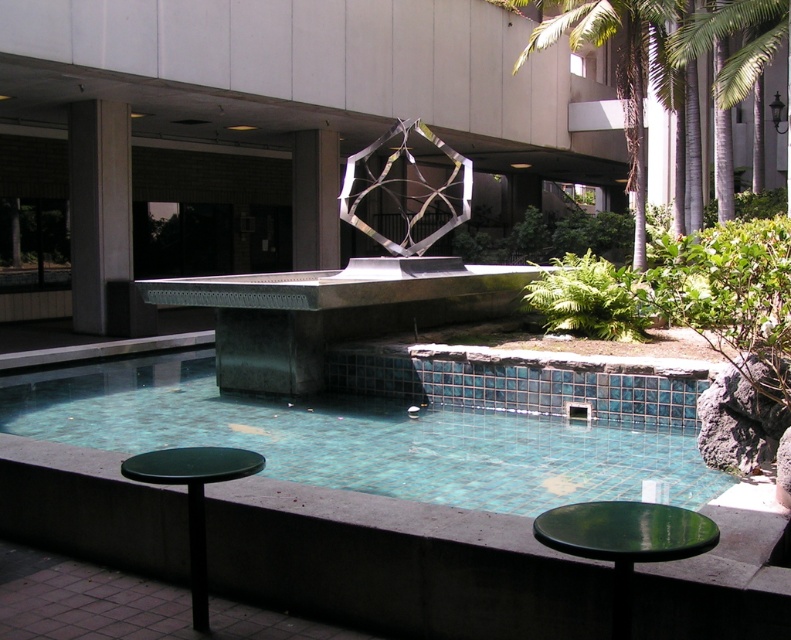
You are standing at the entrance of the urban space and want to reach the teal tile swimming pool at center. According to the coordinates provided, in which direction should you move relative to your current position?

The teal tile swimming pool at center is located at point 0.681 on the x and 0.484 on the y axis. Since you are at the entrance, which is likely positioned at the edge of the space, you should move towards the center direction to reach it.

You are standing at the edge of the pool and want to take a photo of the green leafy palm tree at upper center without the dark gray concrete pillar at left blocking the view. Is this possible?

The dark gray concrete pillar at left is in front of the green leafy palm tree at upper center, so it will block the view. To take a photo of the green leafy palm tree at upper center without the pillar blocking, you need to move to a position where the pillar is not between you and the tree.

You are a visitor standing at the edge of the pool. You notice the dark gray concrete pillar at left and the green leafy palm tree at upper center. Which object is closer to you?

The dark gray concrete pillar at left is closer to you because it is positioned under the green leafy palm tree at upper center, indicating it is in a lower, nearer position.